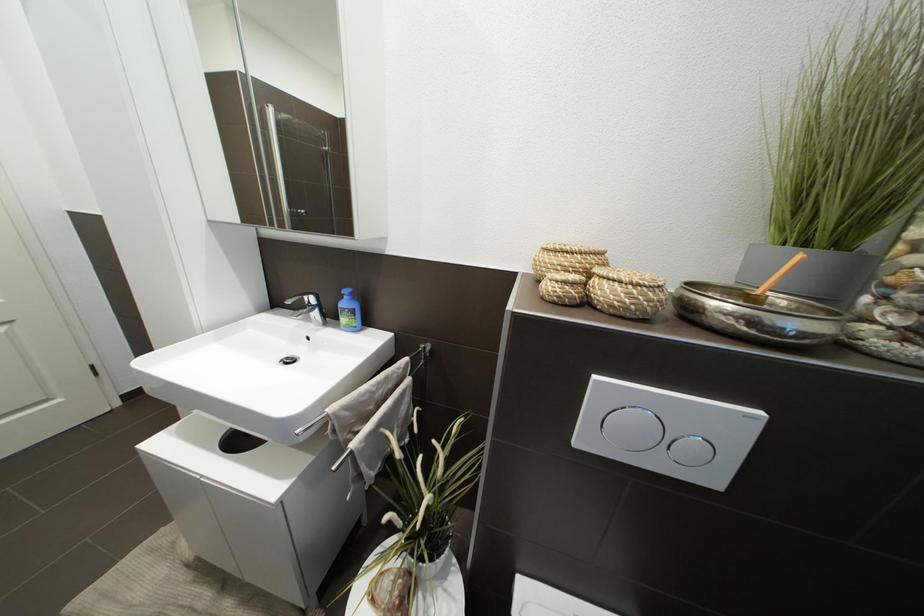
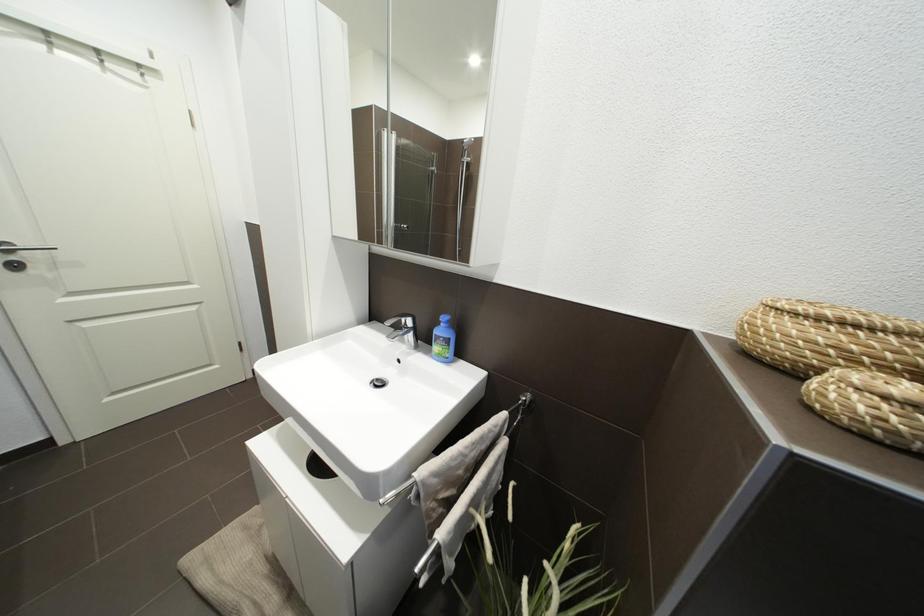
Question: The first image is from the beginning of the video and the second image is from the end. How did the camera likely rotate when shooting the video?

Choices:
 (A) Left
 (B) Right
 (C) Up
 (D) Down

Answer: (A)